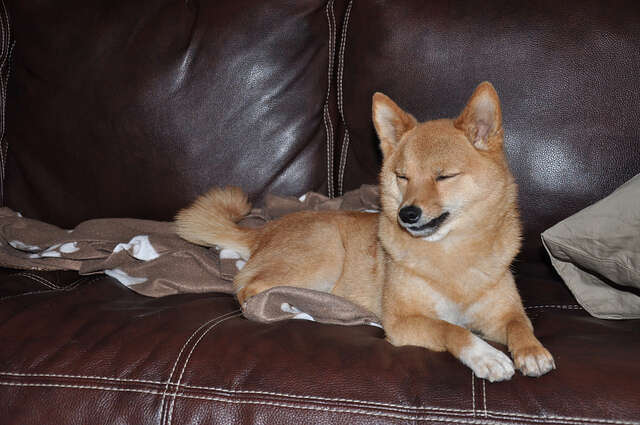
You are a GUI agent. You are given a task and a screenshot of the screen. Output one action in this format:
    pyautogui.click(x=<x>, y=<y>)
    Task: Click on the couch
    This screenshot has width=640, height=425.
    Given the screenshot: What is the action you would take?
    pyautogui.click(x=147, y=321)